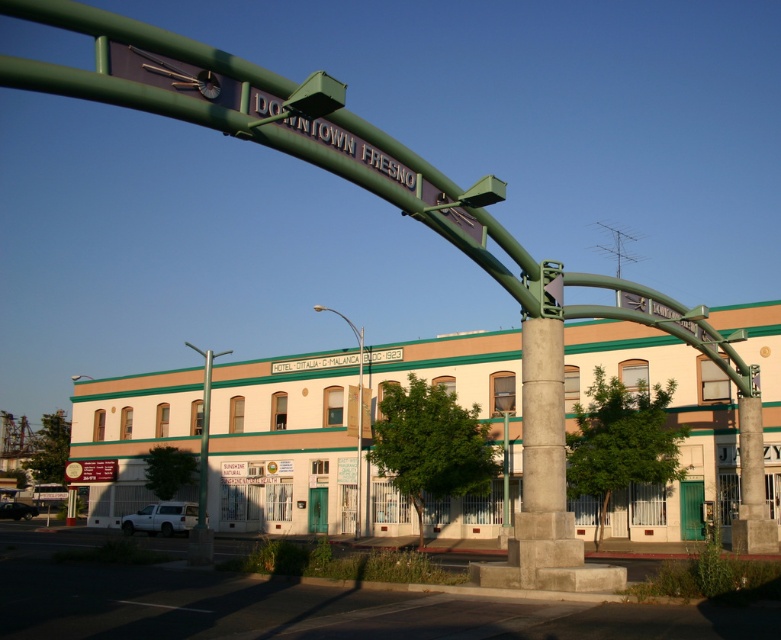
You are a city planner assessing the width of the green metallic pole at center and the metallic street light at lower left for maintenance purposes. Which object has a narrower width?

The green metallic pole at center has a lesser width compared to the metallic street light at lower left, so the green metallic pole at center is narrower.

You are a city planner assessing the Downtown Fresno area. You need to install a new security camera that requires a mounting height of at least 3 meters. Given the green metallic pole at center and the metallic street light at lower left, which structure would be suitable for mounting the camera?

The green metallic pole at center has a greater height compared to the metallic street light at lower left, so it would be suitable for mounting the security camera as it meets the required height of at least 3 meters.

Based on the provided coordinates, can you identify which object is situated at point (x=202, y=474) in the image?

The green metallic pole at center is located at point (x=202, y=474).